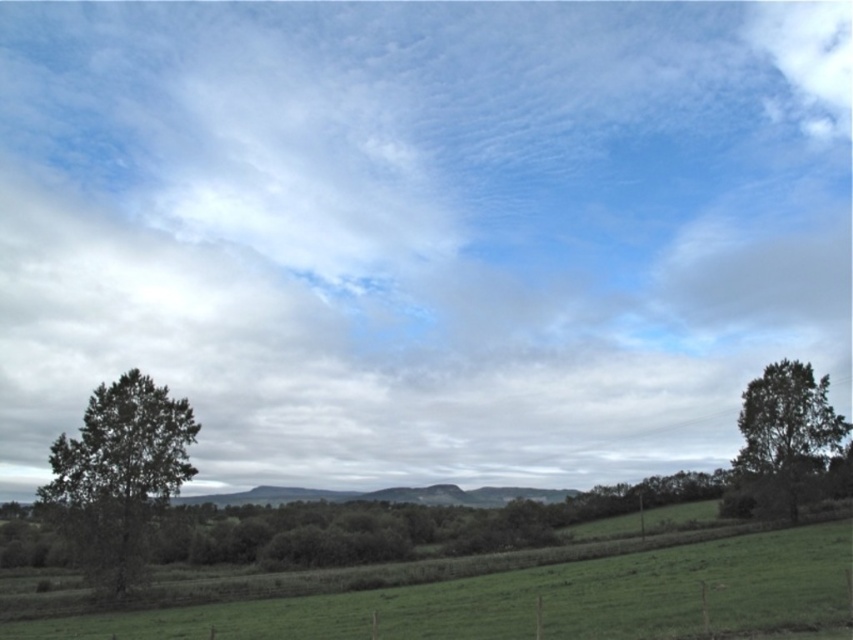
Question: Estimate the real-world distances between objects in this image. Which object is farther from the green leafy tree at right?

Choices:
 (A) green grassy field at lower center
 (B) green matte tree at lower left

Answer: (B)

Question: Observing the image, what is the correct spatial positioning of green matte tree at lower left in reference to green leafy tree at right?

Choices:
 (A) above
 (B) below

Answer: (A)

Question: Observing the image, what is the correct spatial positioning of green grassy field at lower center in reference to green leafy tree at right?

Choices:
 (A) above
 (B) below

Answer: (A)

Question: Which point is closer to the camera?

Choices:
 (A) green grassy field at lower center
 (B) green leafy tree at right

Answer: (A)

Question: Which object is positioned closest to the green leafy tree at right?

Choices:
 (A) green grassy field at lower center
 (B) green matte tree at lower left

Answer: (A)

Question: Considering the relative positions of green grassy field at lower center and green leafy tree at right in the image provided, where is green grassy field at lower center located with respect to green leafy tree at right?

Choices:
 (A) right
 (B) left

Answer: (B)